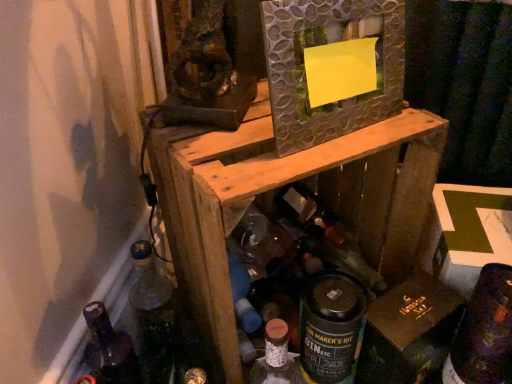
Question: Does dark purple glass wine bottle at lower right, placed as the second wine bottle when sorted from top to bottom, come in front of translucent glass bottle at lower left, positioned as the 1th bottle in left-to-right order?

Choices:
 (A) yes
 (B) no

Answer: (A)

Question: From a real-world perspective, is dark purple glass wine bottle at lower right, the first wine bottle viewed from the front, on top of translucent glass bottle at lower left, the 3th bottle viewed from the right?

Choices:
 (A) yes
 (B) no

Answer: (A)

Question: Is dark purple glass wine bottle at lower right, arranged as the 1th wine bottle when ordered from the bottom, positioned with its back to translucent glass bottle at lower left, positioned as the 1th bottle in left-to-right order?

Choices:
 (A) no
 (B) yes

Answer: (A)

Question: Is dark purple glass wine bottle at lower right, which ranks as the second wine bottle in back-to-front order, aimed at translucent glass bottle at lower left, positioned as the 1th bottle in left-to-right order?

Choices:
 (A) yes
 (B) no

Answer: (B)

Question: From the image's perspective, is dark purple glass wine bottle at lower right, arranged as the 2th wine bottle when viewed from the left, over translucent glass bottle at lower left, positioned as the 1th bottle in left-to-right order?

Choices:
 (A) yes
 (B) no

Answer: (A)

Question: Is point 314,286 closer or farther from the camera than point 403,307?

Choices:
 (A) farther
 (B) closer

Answer: (B)

Question: From a real-world perspective, is green matte can at center, which appears as the 1th bottle when viewed from the right, above or below brown cardboard at lower right?

Choices:
 (A) above
 (B) below

Answer: (A)

Question: Visually, is green matte can at center, which appears as the 1th bottle when viewed from the right, positioned to the left or to the right of brown cardboard at lower right?

Choices:
 (A) left
 (B) right

Answer: (A)

Question: Considering the positions of green matte can at center, which appears as the 1th bottle when viewed from the right, and brown cardboard at lower right in the image, is green matte can at center, which appears as the 1th bottle when viewed from the right, wider or thinner than brown cardboard at lower right?

Choices:
 (A) thin
 (B) wide

Answer: (B)

Question: Do you think wooden crate at center is within brown cardboard at lower right, or outside of it?

Choices:
 (A) inside
 (B) outside

Answer: (B)

Question: Based on their positions, is wooden crate at center located to the left or right of brown cardboard at lower right?

Choices:
 (A) right
 (B) left

Answer: (B)

Question: From their relative heights in the image, would you say wooden crate at center is taller or shorter than brown cardboard at lower right?

Choices:
 (A) tall
 (B) short

Answer: (A)

Question: From a real-world perspective, is wooden crate at center above or below brown cardboard at lower right?

Choices:
 (A) above
 (B) below

Answer: (A)

Question: Is point (374, 97) positioned closer to the camera than point (311, 150)?

Choices:
 (A) closer
 (B) farther

Answer: (B)

Question: From the image's perspective, is textured silver mirror at center located above or below wooden crate at center?

Choices:
 (A) above
 (B) below

Answer: (A)